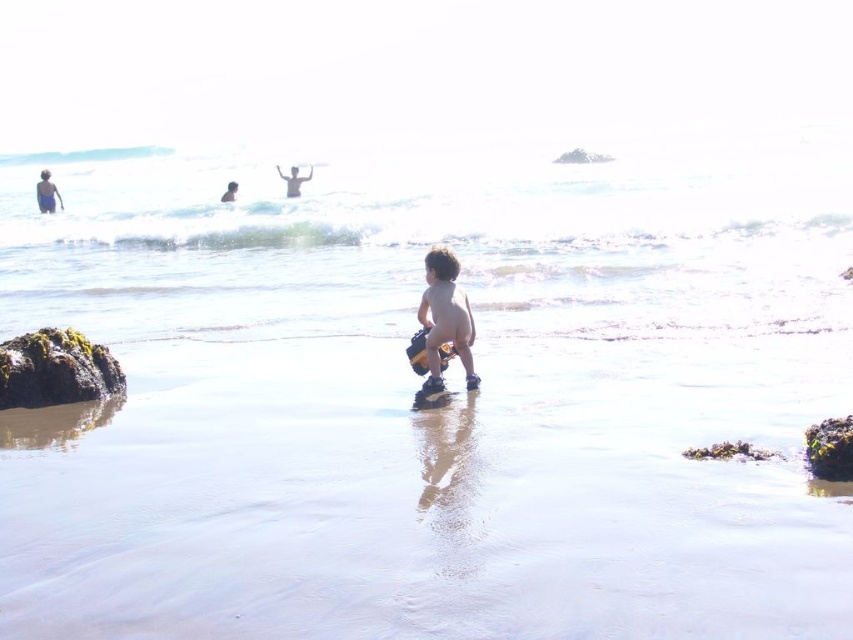
You are a photographer trying to capture the child playing with the toy boat in the beach scene. To ensure the smooth sand at center and matte blue shorts at upper left are both visible in the frame, which object should you position closer to the camera?

The smooth sand at center is shorter than the matte blue shorts at upper left, so you should position the smooth sand at center closer to the camera to ensure both are visible in the frame.

You are a photographer trying to capture the child playing on the beach. To ensure the green mossy rock at lower left is in the frame, where should you position your camera relative to the child?

The green mossy rock at lower left is located at point (55,369) in the image. To include it in the frame, position the camera to the lower left side of the child so that the rock remains visible in the lower left corner of the photo.